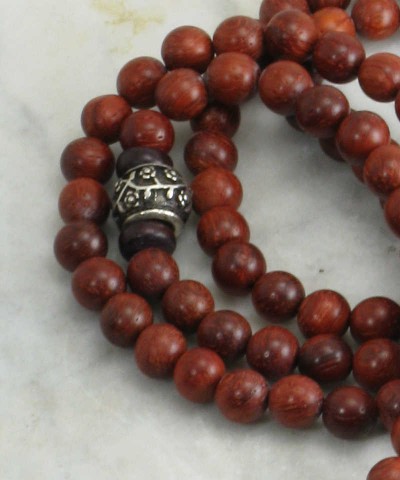
At what (x,y) coordinates should I click in order to perform the action: click on gray marks on countertop. Please return your answer as a coordinate pair (x, y). This screenshot has width=400, height=480. Looking at the image, I should click on (60, 380), (93, 457), (302, 225).